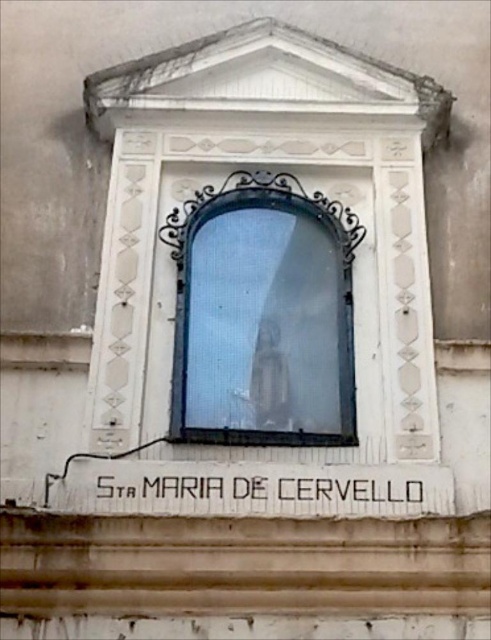
You are standing in front of the building facade and want to locate the clear glass statue at center. What are the coordinates where you should look to find it?

The clear glass statue at center is located at coordinates point (263, 314).

You are a visitor standing in front of the building facade and want to read the text on the black painted wood sign at center. However, the clear glass statue at center is blocking your view. Can you move the statue to access the sign?

The clear glass statue at center is positioned over the black painted wood sign at center, so you would need to move the statue to access the sign. However, since the statue is made of clear glass, you might be able to read the sign through it if the glass is not completely opaque.

You are an interior designer who needs to ensure that the clear glass statue at center and the black painted wood sign at center are placed proportionally. Based on their sizes, which object should be positioned closer to the entrance for better visual balance?

The clear glass statue at center is smaller than the black painted wood sign at center. To achieve visual balance, the smaller clear glass statue at center should be placed closer to the entrance while the larger black painted wood sign at center is positioned further back. This arrangement balances their sizes by compensating with distance, ensuring both elements are visually harmonious.